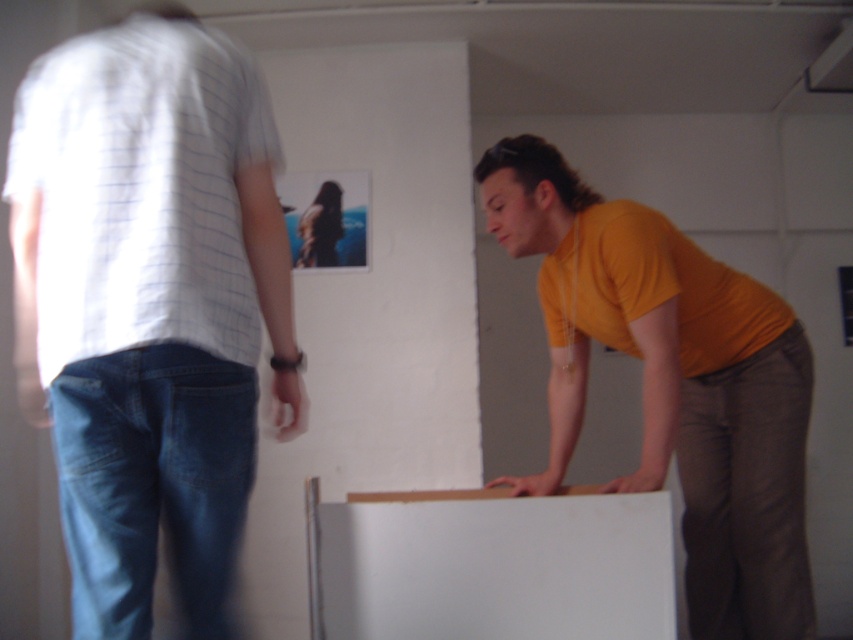
Measure the distance between matte white shirt at left and camera.

They are 1.12 meters apart.

Is point (157, 56) farther from viewer compared to point (563, 253)?

No, (157, 56) is closer to viewer.

This screenshot has width=853, height=640. Find the location of `matte white shirt at left`. matte white shirt at left is located at coordinates (149, 305).

Between matte white shirt at left and smooth brown hair at upper center, which one is positioned lower?

matte white shirt at left is below.

Based on the photo, does matte white shirt at left have a larger size compared to smooth brown hair at upper center?

Correct, matte white shirt at left is larger in size than smooth brown hair at upper center.

Is point (115, 237) closer to camera compared to point (328, 237)?

That is True.

Find the location of a particular element. The height and width of the screenshot is (640, 853). matte white shirt at left is located at coordinates (149, 305).

Between point (660, 381) and point (335, 195), which one is positioned in front?

Point (660, 381)

How distant is matte yellow shirt at right from smooth brown hair at upper center?

The distance of matte yellow shirt at right from smooth brown hair at upper center is 1.46 meters.

The image size is (853, 640). What do you see at coordinates (672, 381) in the screenshot?
I see `matte yellow shirt at right` at bounding box center [672, 381].

Where is `matte yellow shirt at right`? matte yellow shirt at right is located at coordinates (672, 381).